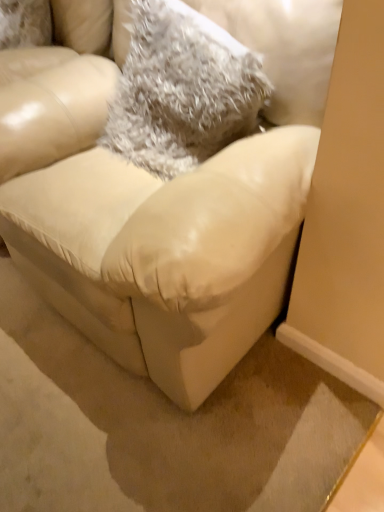
Question: Choose the correct answer: Is fuzzy gray throw pillow at upper center inside matte leather couch at center or outside it?

Choices:
 (A) inside
 (B) outside

Answer: (A)

Question: Based on their sizes in the image, would you say fuzzy gray throw pillow at upper center is bigger or smaller than matte leather couch at center?

Choices:
 (A) big
 (B) small

Answer: (B)

Question: From the image's perspective, is fuzzy gray throw pillow at upper center positioned above or below matte leather couch at center?

Choices:
 (A) below
 (B) above

Answer: (B)

Question: From a real-world perspective, is matte leather couch at center physically located above or below fuzzy gray throw pillow at upper center?

Choices:
 (A) below
 (B) above

Answer: (A)

Question: Considering the positions of matte leather couch at center and fuzzy gray throw pillow at upper center in the image, is matte leather couch at center taller or shorter than fuzzy gray throw pillow at upper center?

Choices:
 (A) short
 (B) tall

Answer: (B)

Question: Is point (29, 64) closer or farther from the camera than point (188, 54)?

Choices:
 (A) closer
 (B) farther

Answer: (B)

Question: Is matte leather couch at center in front of or behind fuzzy gray throw pillow at upper center in the image?

Choices:
 (A) behind
 (B) front

Answer: (B)